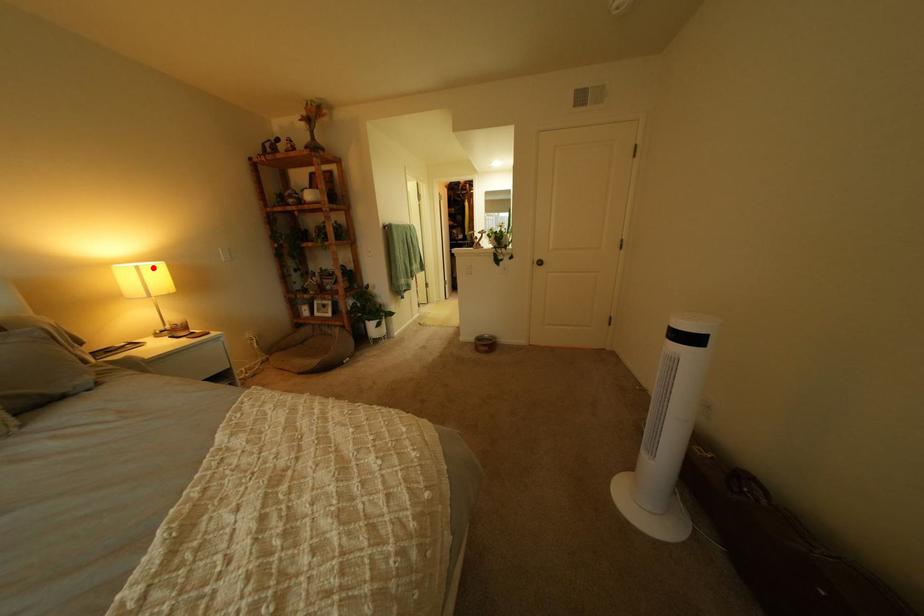
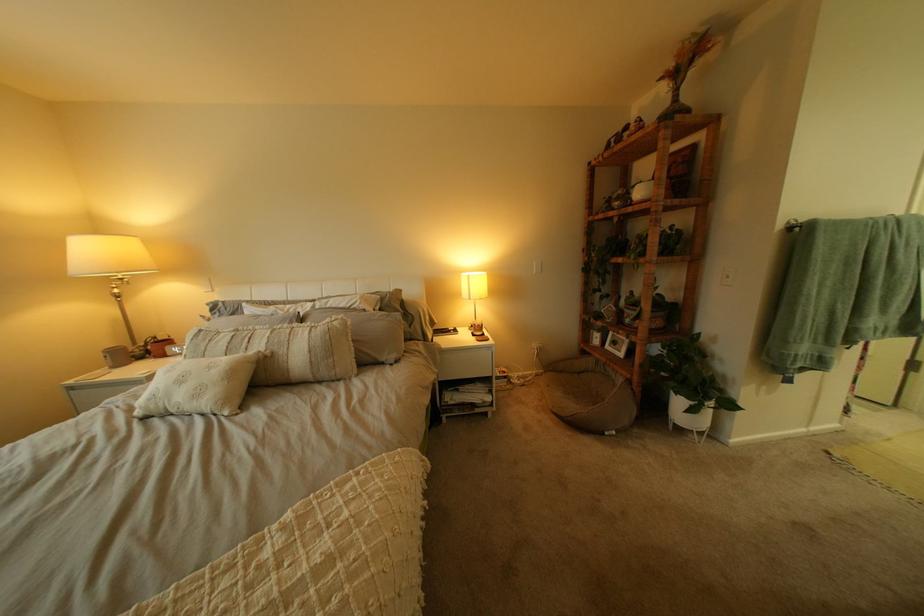
Where in the second image is the point corresponding to the highlighted location from the first image?

(483, 277)